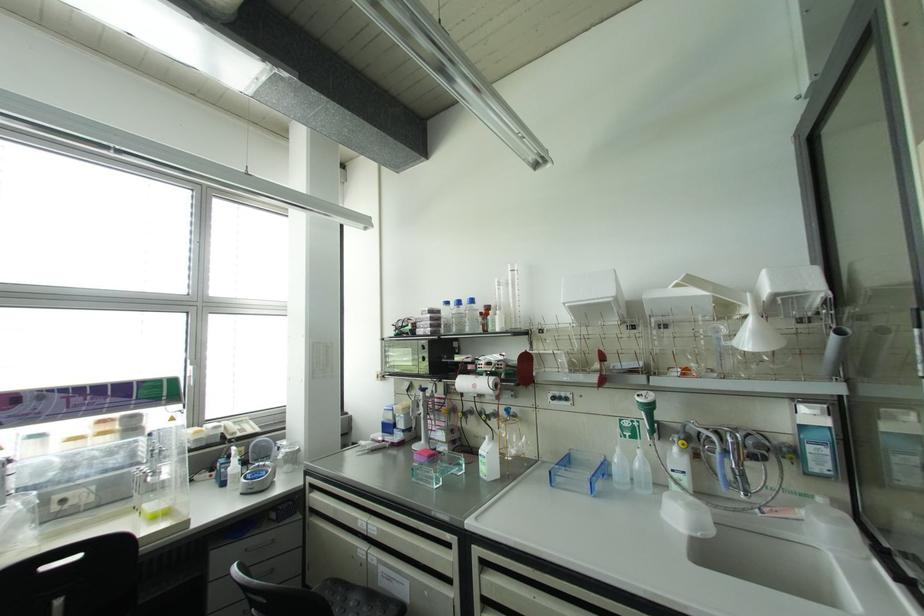
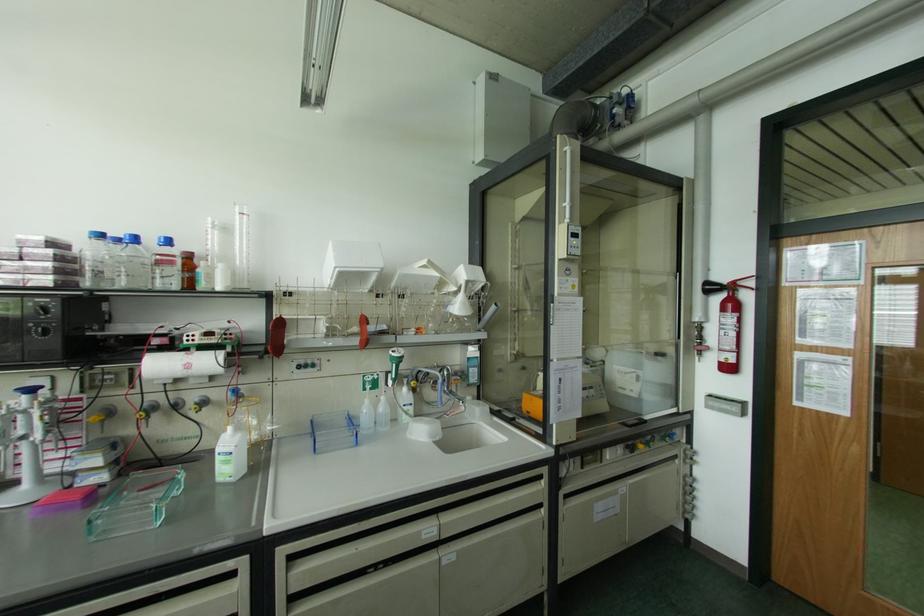
Find the pixel in the second image that matches (638,451) in the first image.

(382, 398)